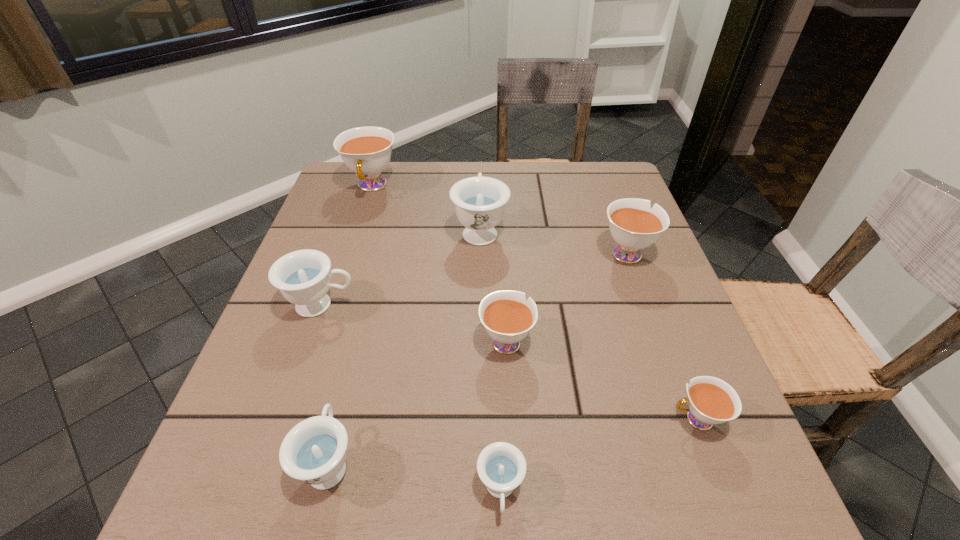
Where is `vacant area between the smallest blue teacup and the third farthest white teacup`? The width and height of the screenshot is (960, 540). vacant area between the smallest blue teacup and the third farthest white teacup is located at coordinates (503, 415).

This screenshot has height=540, width=960. Find the location of `vacant region between the farthest object and the farthest blue teacup`. vacant region between the farthest object and the farthest blue teacup is located at coordinates (426, 208).

This screenshot has width=960, height=540. Identify the location of vacant area between the third farthest white teacup and the third smallest white teacup. (565, 296).

You are a GUI agent. You are given a task and a screenshot of the screen. Output one action in this format:
    pyautogui.click(x=<x>, y=<y>)
    Task: Click on the fifth closest object to the smallest blue teacup
    This screenshot has width=960, height=540.
    Given the screenshot: What is the action you would take?
    pyautogui.click(x=634, y=225)

The image size is (960, 540). Identify the location of object that is the seventh closest to the farthest blue teacup. (501, 466).

Point out which teacup is positioned as the seventh nearest to the biggest white teacup. Please provide its 2D coordinates. Your answer should be formatted as a tuple, i.e. [(x, y)], where the tuple contains the x and y coordinates of a point satisfying the conditions above.

[(711, 400)]

Where is `the fifth closest teacup to the second biggest blue teacup`? the fifth closest teacup to the second biggest blue teacup is located at coordinates (501, 466).

Where is `the closest white teacup to the nearest white teacup`? the closest white teacup to the nearest white teacup is located at coordinates (507, 317).

The width and height of the screenshot is (960, 540). I want to click on the fourth closest white teacup to the smallest blue teacup, so click(366, 151).

This screenshot has height=540, width=960. I want to click on blue teacup that is the second nearest to the third nearest blue teacup, so click(479, 201).